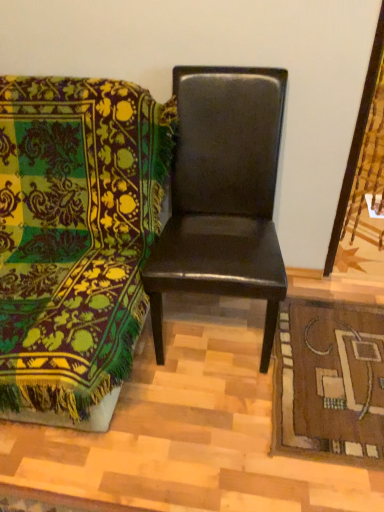
Identify the location of matte black chair at center, the second chair from the right. (76, 241).

From a real-world perspective, is matte black chair at center, positioned as the 1th chair in left-to-right order, on top of brown woven mat at lower right?

Yes, from a real-world perspective, matte black chair at center, positioned as the 1th chair in left-to-right order, is above brown woven mat at lower right.

This screenshot has width=384, height=512. I want to click on mat located on the right of matte black chair at center, the second chair from the right, so click(x=329, y=382).

From the image's perspective, is matte black chair at center, the second chair from the right, positioned above or below brown woven mat at lower right?

Based on their image positions, matte black chair at center, the second chair from the right, is located above brown woven mat at lower right.

Based on the photo, based on their positions, is matte black chair at center, the second chair from the right, located to the left or right of brown woven mat at lower right?

matte black chair at center, the second chair from the right, is to the left of brown woven mat at lower right.

Which of these two, brown woven mat at lower right or glossy black chair at center, which is the second chair in left-to-right order, is bigger?

glossy black chair at center, which is the second chair in left-to-right order.

Which is more to the left, brown woven mat at lower right or glossy black chair at center, the first chair positioned from the right?

From the viewer's perspective, glossy black chair at center, the first chair positioned from the right, appears more on the left side.

Considering the sizes of brown woven mat at lower right and glossy black chair at center, which is the second chair in left-to-right order, in the image, is brown woven mat at lower right taller or shorter than glossy black chair at center, which is the second chair in left-to-right order,?

Clearly, brown woven mat at lower right is shorter compared to glossy black chair at center, which is the second chair in left-to-right order.

From the image's perspective, is matte black chair at center, the second chair from the right, above or below glossy black chair at center, which is the second chair in left-to-right order?

matte black chair at center, the second chair from the right, is below glossy black chair at center, which is the second chair in left-to-right order.

From a real-world perspective, is matte black chair at center, the second chair from the right, over glossy black chair at center, which is the second chair in left-to-right order?

No, from a real-world perspective, matte black chair at center, the second chair from the right, is not above glossy black chair at center, which is the second chair in left-to-right order.

Based on the photo, considering the sizes of objects matte black chair at center, positioned as the 1th chair in left-to-right order, and glossy black chair at center, the first chair positioned from the right, in the image provided, who is wider, matte black chair at center, positioned as the 1th chair in left-to-right order, or glossy black chair at center, the first chair positioned from the right,?

matte black chair at center, positioned as the 1th chair in left-to-right order.

In the scene shown: Considering the sizes of objects glossy black chair at center, which is the second chair in left-to-right order, and brown woven mat at lower right in the image provided, who is thinner, glossy black chair at center, which is the second chair in left-to-right order, or brown woven mat at lower right?

With smaller width is glossy black chair at center, which is the second chair in left-to-right order.

From the image's perspective, is glossy black chair at center, which is the second chair in left-to-right order, under brown woven mat at lower right?

No, from the image's perspective, glossy black chair at center, which is the second chair in left-to-right order, is not below brown woven mat at lower right.

From a real-world perspective, is glossy black chair at center, which is the second chair in left-to-right order, on brown woven mat at lower right?

Yes, from a real-world perspective, glossy black chair at center, which is the second chair in left-to-right order, is on top of brown woven mat at lower right.

Is glossy black chair at center, the first chair positioned from the right, not near brown woven mat at lower right?

They are positioned close to each other.

Is the position of glossy black chair at center, which is the second chair in left-to-right order, less distant than that of matte black chair at center, positioned as the 1th chair in left-to-right order?

No, glossy black chair at center, which is the second chair in left-to-right order, is further to the viewer.

Is glossy black chair at center, which is the second chair in left-to-right order, facing away from matte black chair at center, positioned as the 1th chair in left-to-right order?

No, glossy black chair at center, which is the second chair in left-to-right order, is not facing away from matte black chair at center, positioned as the 1th chair in left-to-right order.

Which is more to the right, glossy black chair at center, which is the second chair in left-to-right order, or matte black chair at center, positioned as the 1th chair in left-to-right order?

From the viewer's perspective, glossy black chair at center, which is the second chair in left-to-right order, appears more on the right side.

From a real-world perspective, does glossy black chair at center, which is the second chair in left-to-right order, sit lower than matte black chair at center, positioned as the 1th chair in left-to-right order?

No, from a real-world perspective, glossy black chair at center, which is the second chair in left-to-right order, is not below matte black chair at center, positioned as the 1th chair in left-to-right order.

From the image's perspective, is brown woven mat at lower right located above or below matte black chair at center, positioned as the 1th chair in left-to-right order?

Based on their image positions, brown woven mat at lower right is located beneath matte black chair at center, positioned as the 1th chair in left-to-right order.

Can you confirm if brown woven mat at lower right is thinner than matte black chair at center, the second chair from the right?

Correct, the width of brown woven mat at lower right is less than that of matte black chair at center, the second chair from the right.

Is the position of brown woven mat at lower right more distant than that of matte black chair at center, positioned as the 1th chair in left-to-right order?

Yes, the depth of brown woven mat at lower right is greater than that of matte black chair at center, positioned as the 1th chair in left-to-right order.

Where is `the 1st chair above the brown woven mat at lower right (from the image's perspective)`? This screenshot has width=384, height=512. the 1st chair above the brown woven mat at lower right (from the image's perspective) is located at coordinates (76, 241).

From a real-world perspective, count 2nd chairs upward from the brown woven mat at lower right and point to it. Please provide its 2D coordinates.

[(223, 194)]

From the image, which object appears to be farther from matte black chair at center, positioned as the 1th chair in left-to-right order, brown woven mat at lower right or glossy black chair at center, the first chair positioned from the right?

The object further to matte black chair at center, positioned as the 1th chair in left-to-right order, is brown woven mat at lower right.

Estimate the real-world distances between objects in this image. Which object is closer to brown woven mat at lower right, glossy black chair at center, the first chair positioned from the right, or matte black chair at center, the second chair from the right?

Among the two, glossy black chair at center, the first chair positioned from the right, is located nearer to brown woven mat at lower right.

Which object lies nearer to the anchor point glossy black chair at center, the first chair positioned from the right, brown woven mat at lower right or matte black chair at center, positioned as the 1th chair in left-to-right order?

The object closer to glossy black chair at center, the first chair positioned from the right, is matte black chair at center, positioned as the 1th chair in left-to-right order.

Which object lies further to the anchor point brown woven mat at lower right, matte black chair at center, positioned as the 1th chair in left-to-right order, or glossy black chair at center, the first chair positioned from the right?

matte black chair at center, positioned as the 1th chair in left-to-right order, lies further to brown woven mat at lower right than the other object.

Based on their spatial positions, is matte black chair at center, positioned as the 1th chair in left-to-right order, or brown woven mat at lower right closer to glossy black chair at center, the first chair positioned from the right?

matte black chair at center, positioned as the 1th chair in left-to-right order.

Estimate the real-world distances between objects in this image. Which object is further from matte black chair at center, positioned as the 1th chair in left-to-right order, glossy black chair at center, which is the second chair in left-to-right order, or brown woven mat at lower right?

Among the two, brown woven mat at lower right is located further to matte black chair at center, positioned as the 1th chair in left-to-right order.

You are a GUI agent. You are given a task and a screenshot of the screen. Output one action in this format:
    pyautogui.click(x=<x>, y=<y>)
    Task: Click on the chair between matte black chair at center, positioned as the 1th chair in left-to-right order, and brown woven mat at lower right from left to right
    This screenshot has width=384, height=512.
    Given the screenshot: What is the action you would take?
    pyautogui.click(x=223, y=194)